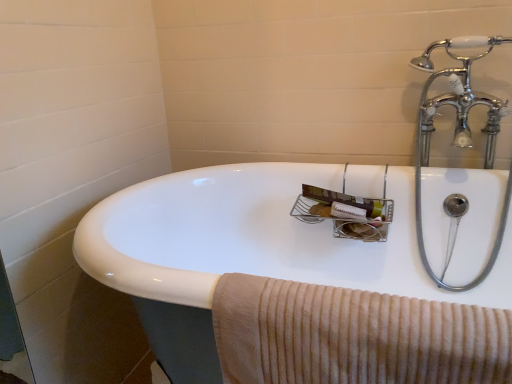
Question: In terms of height, does white glossy sink at center look taller or shorter compared to beige corduroy towel at lower right?

Choices:
 (A) tall
 (B) short

Answer: (A)

Question: In terms of width, does white glossy sink at center look wider or thinner when compared to beige corduroy towel at lower right?

Choices:
 (A) wide
 (B) thin

Answer: (A)

Question: Based on their positions, is white glossy sink at center located to the left or right of beige corduroy towel at lower right?

Choices:
 (A) right
 (B) left

Answer: (A)

Question: Considering their positions, is beige corduroy towel at lower right located in front of or behind white glossy sink at center?

Choices:
 (A) front
 (B) behind

Answer: (B)

Question: From their relative heights in the image, would you say beige corduroy towel at lower right is taller or shorter than white glossy sink at center?

Choices:
 (A) short
 (B) tall

Answer: (A)

Question: From a real-world perspective, is beige corduroy towel at lower right physically located above or below white glossy sink at center?

Choices:
 (A) below
 (B) above

Answer: (B)

Question: Would you say beige corduroy towel at lower right is inside or outside white glossy sink at center?

Choices:
 (A) outside
 (B) inside

Answer: (B)